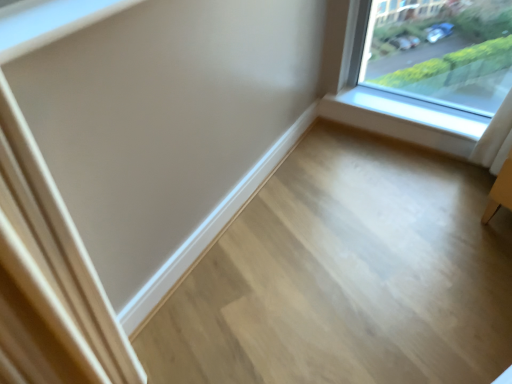
This screenshot has height=384, width=512. Find the location of `white smooth window sill at upper right`. white smooth window sill at upper right is located at coordinates pyautogui.click(x=405, y=119).

Describe the element at coordinates (405, 119) in the screenshot. This screenshot has width=512, height=384. I see `white smooth window sill at upper right` at that location.

This screenshot has width=512, height=384. Find the location of `white smooth window sill at upper right`. white smooth window sill at upper right is located at coordinates (405, 119).